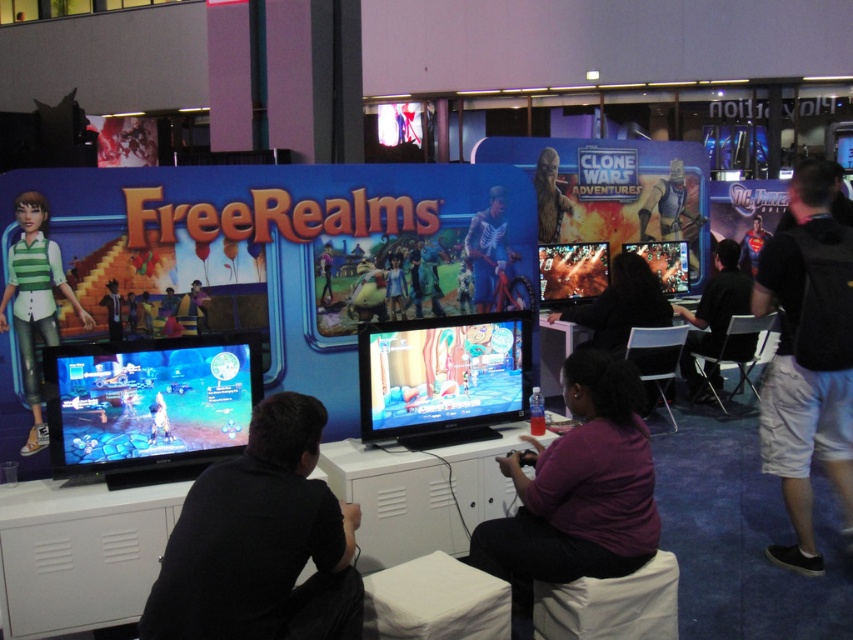
You are at a gaming convention and see two attendees wearing purple matte shirt at center and green striped shirt at left. Which shirt is positioned more to the right side of the image?

The purple matte shirt at center is positioned more to the right side of the image compared to the green striped shirt at left.

You are a photographer standing at the center of the gaming area. You want to take a photo that includes both the green striped shirt at left and the dark gray shirt at right. Given that your camera has a maximum zoom range of 10 meters, will you be able to capture both shirts in a single frame without moving closer?

The green striped shirt at left is 4.49 meters from the dark gray shirt at right. Since your camera can zoom up to 10 meters, which is greater than the distance between them, you can capture both shirts in a single frame without moving closer.